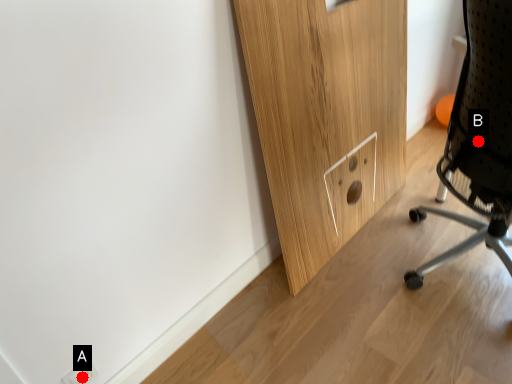
Question: Two points are circled on the image, labeled by A and B beside each circle. Which point is closer to the camera?

Choices:
 (A) A is closer
 (B) B is closer

Answer: (A)